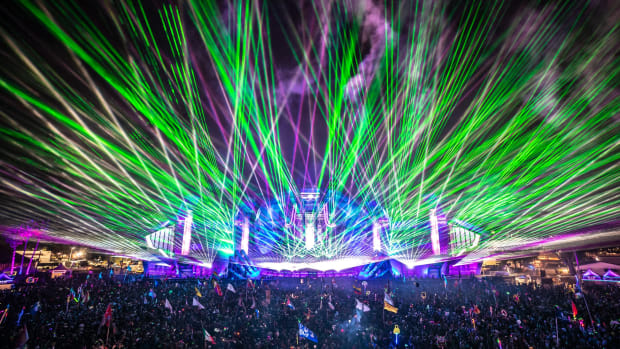
The width and height of the screenshot is (620, 349). I want to click on stage backdrop, so click(x=162, y=237), click(x=187, y=239), click(x=242, y=234), click(x=304, y=227), click(x=373, y=243), click(x=439, y=242).